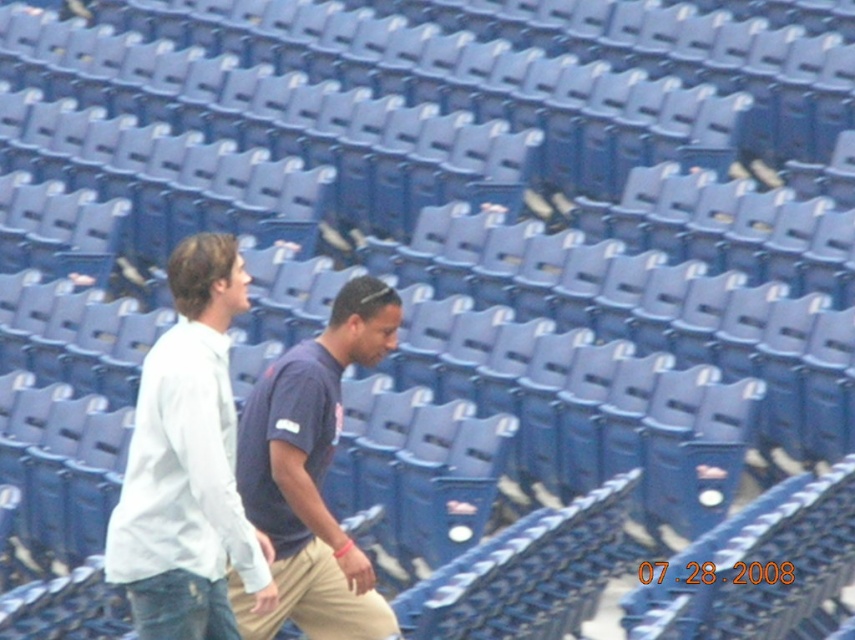
Does point (136, 538) lie behind point (299, 570)?

No, (136, 538) is in front of (299, 570).

Between white cotton shirt at center and dark blue t-shirt at center, which one has more height?

white cotton shirt at center

Does point (139, 486) come in front of point (267, 525)?

Yes.

Identify the location of white cotton shirt at center. This screenshot has height=640, width=855. (187, 465).